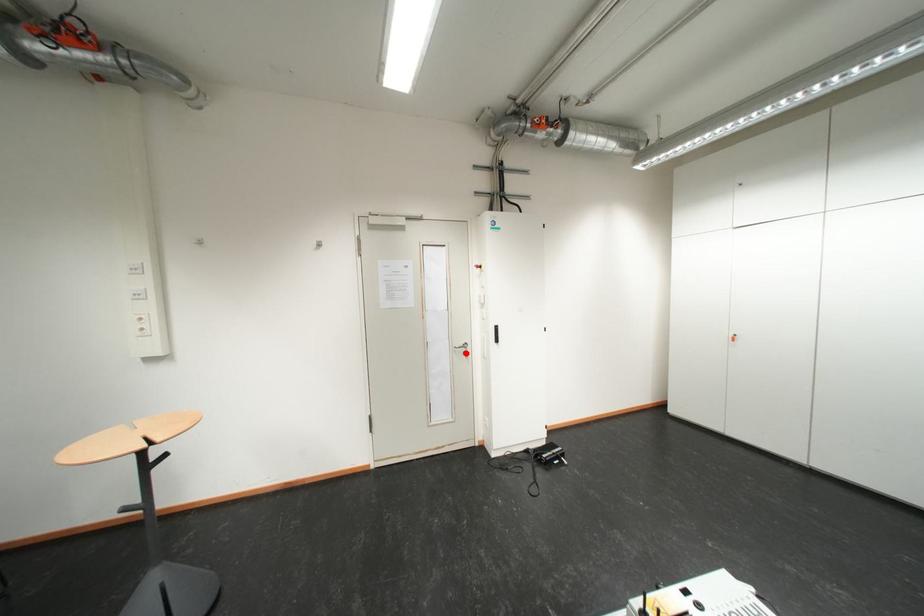
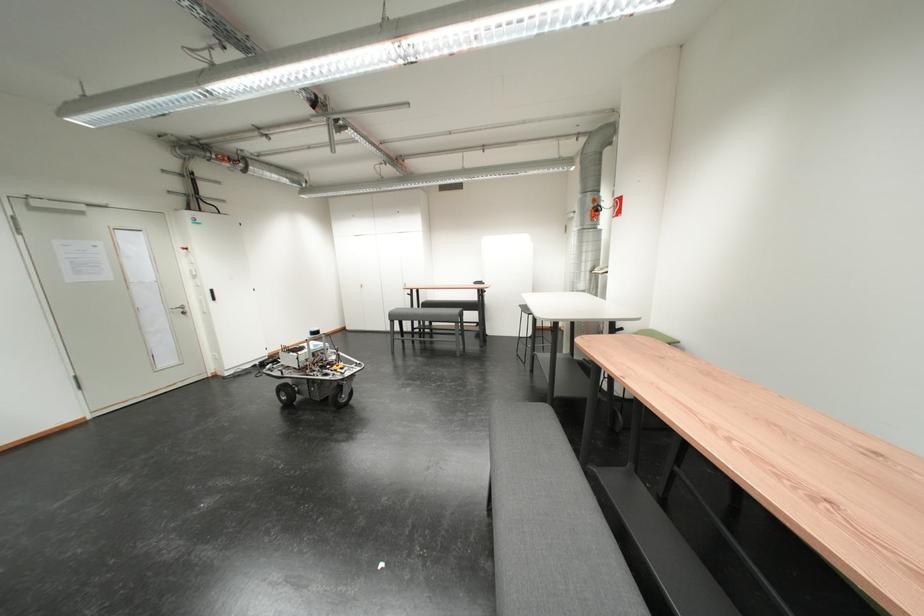
The point at the highlighted location is marked in the first image. Where is the corresponding point in the second image?

(184, 314)